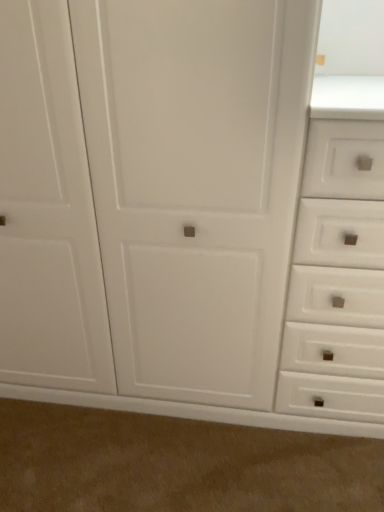
Question: Based on their sizes in the image, would you say beige carpet at lower center is bigger or smaller than white matte drawer at right?

Choices:
 (A) small
 (B) big

Answer: (A)

Question: In the image, is beige carpet at lower center positioned in front of or behind white matte drawer at right?

Choices:
 (A) behind
 (B) front

Answer: (A)

Question: Considering the positions of beige carpet at lower center and white matte drawer at right in the image, is beige carpet at lower center wider or thinner than white matte drawer at right?

Choices:
 (A) wide
 (B) thin

Answer: (B)

Question: Is white matte drawer at right situated inside beige carpet at lower center or outside?

Choices:
 (A) outside
 (B) inside

Answer: (A)

Question: Looking at their shapes, would you say white matte drawer at right is wider or thinner than beige carpet at lower center?

Choices:
 (A) wide
 (B) thin

Answer: (A)

Question: Visually, is white matte drawer at right positioned to the left or to the right of beige carpet at lower center?

Choices:
 (A) right
 (B) left

Answer: (A)

Question: From a real-world perspective, relative to beige carpet at lower center, is white matte drawer at right vertically above or below?

Choices:
 (A) above
 (B) below

Answer: (A)